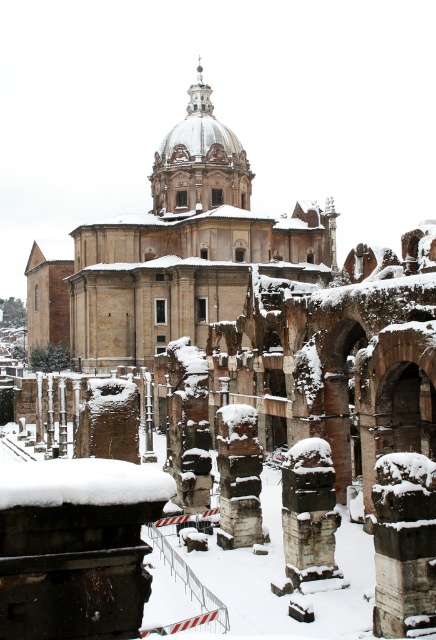
Can you confirm if white fluffy snow at lower left is thinner than snow-covered stone column at center?

In fact, white fluffy snow at lower left might be wider than snow-covered stone column at center.

From the picture: Who is taller, white fluffy snow at lower left or snow-covered stone column at center?

Standing taller between the two is white fluffy snow at lower left.

Identify the location of white fluffy snow at lower left. The image size is (436, 640). (81, 483).

At what (x,y) coordinates should I click in order to perform the action: click on white fluffy snow at lower left. Please return your answer as a coordinate pair (x, y). Image resolution: width=436 pixels, height=640 pixels. Looking at the image, I should click on (81, 483).

Does beige stone church at center have a larger size compared to white fluffy snow at lower left?

Correct, beige stone church at center is larger in size than white fluffy snow at lower left.

Consider the image. Which is more to the right, beige stone church at center or white fluffy snow at lower left?

From the viewer's perspective, white fluffy snow at lower left appears more on the right side.

Between point (129, 244) and point (174, 492), which one is positioned in front?

Point (174, 492) is more forward.

This screenshot has height=640, width=436. Find the location of `beige stone church at center`. beige stone church at center is located at coordinates (171, 252).

Find the location of a particular element. The image size is (436, 640). beige stone church at center is located at coordinates (171, 252).

Between beige stone church at center and snow-covered stone column at center, which one has more height?

With more height is beige stone church at center.

I want to click on beige stone church at center, so click(171, 252).